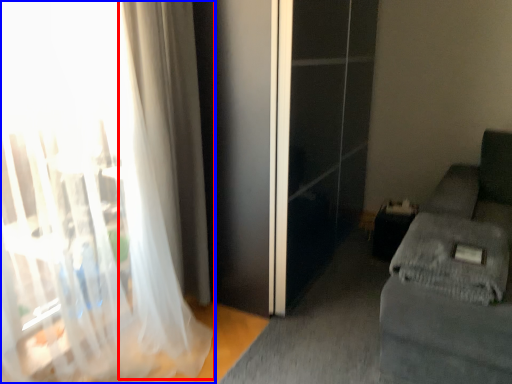
Question: Which point is closer to the camera, curtain (highlighted by a red box) or curtain (highlighted by a blue box)?

Choices:
 (A) curtain
 (B) curtain

Answer: (B)